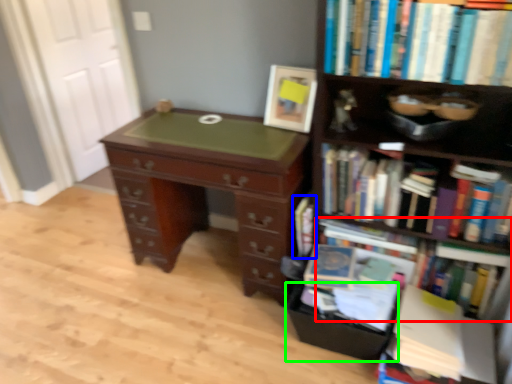
Question: Which object is the farthest from book (highlighted by a red box)? Choose among these: book (highlighted by a blue box) or drawer (highlighted by a green box).

Choices:
 (A) book
 (B) drawer

Answer: (B)